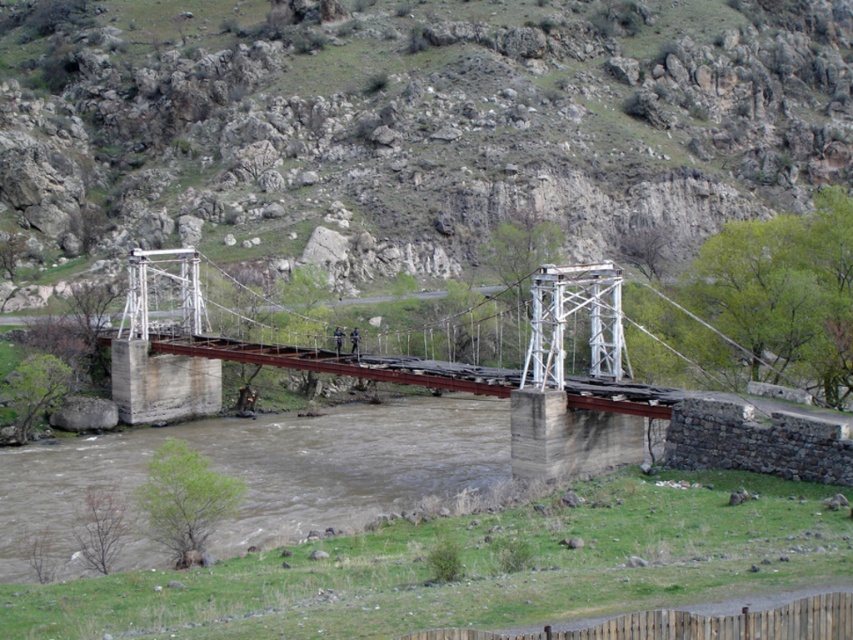
Question: Which point is farther to the camera?

Choices:
 (A) (746, 182)
 (B) (553, 385)

Answer: (A)

Question: Can you confirm if green grassy hillside at upper center is positioned above rusty metal bridge at center?

Choices:
 (A) no
 (B) yes

Answer: (B)

Question: Which point is closer to the camera?

Choices:
 (A) (7, 160)
 (B) (561, 310)

Answer: (B)

Question: Is green grassy hillside at upper center bigger than rusty metal bridge at center?

Choices:
 (A) yes
 (B) no

Answer: (A)

Question: Can you confirm if green grassy hillside at upper center is wider than rusty metal bridge at center?

Choices:
 (A) yes
 (B) no

Answer: (A)